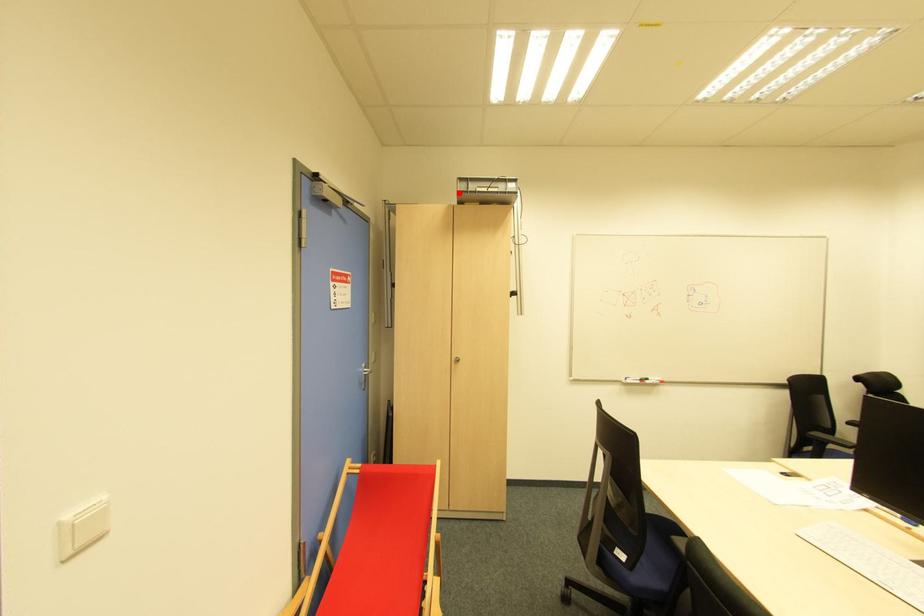
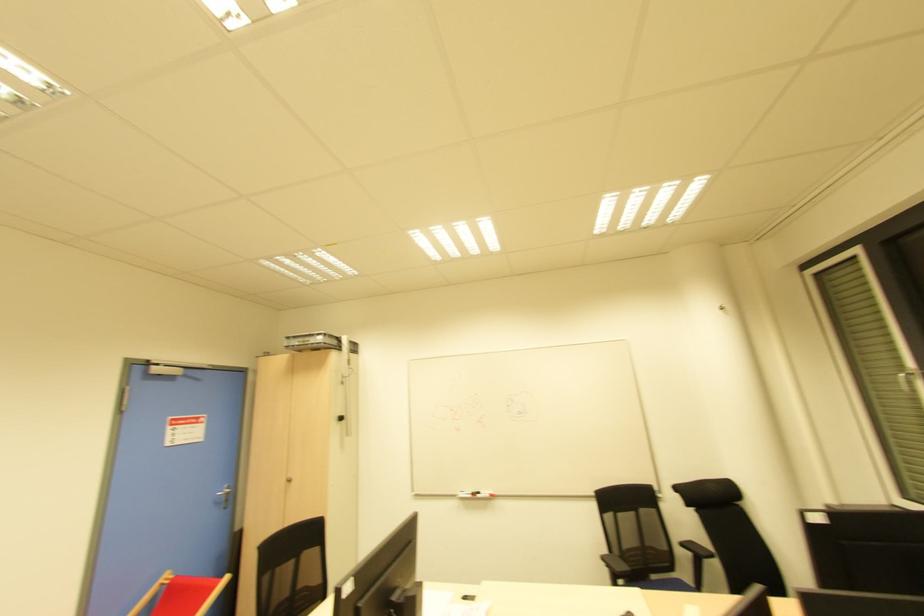
Where in the second image is the point corresponding to the highlighted location from the first image?

(286, 347)